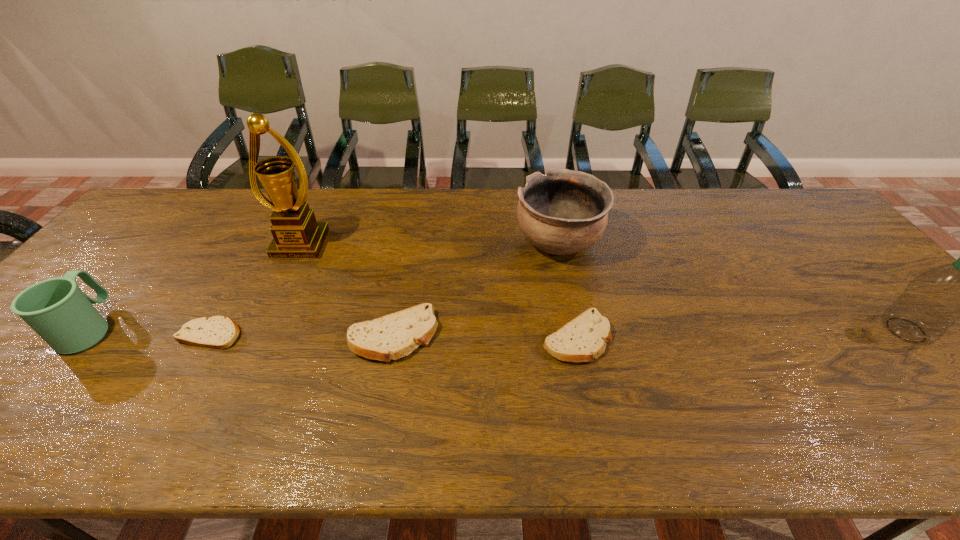
Identify the location of water bottle. (932, 302).

Find the location of a particular element. Image resolution: width=960 pixels, height=540 pixels. the rightmost object is located at coordinates (932, 302).

Where is `vacant area located 0.100m on the left of the shortest object`? vacant area located 0.100m on the left of the shortest object is located at coordinates (138, 334).

Where is `vacant position located on the right of the fourth object from right to left`? Image resolution: width=960 pixels, height=540 pixels. vacant position located on the right of the fourth object from right to left is located at coordinates (532, 336).

Where is `free space located 0.280m on the right of the rightmost pita bread`? The width and height of the screenshot is (960, 540). free space located 0.280m on the right of the rightmost pita bread is located at coordinates (727, 338).

At what (x,y) coordinates should I click in order to perform the action: click on vacant space situated on the side of the fourth shortest object with the handle. Please return your answer as a coordinate pair (x, y). This screenshot has height=540, width=960. Looking at the image, I should click on (145, 262).

The image size is (960, 540). What are the coordinates of `vacant point located 0.150m on the side of the fourth shortest object with the handle` in the screenshot? It's located at (143, 265).

Locate an element on the screen. Image resolution: width=960 pixels, height=540 pixels. vacant area located 0.310m on the side of the fourth shortest object with the handle is located at coordinates (172, 231).

Locate an element on the screen. free location located 0.060m on the front of the third tallest object is located at coordinates (567, 287).

Locate an element on the screen. vacant region located on the front-facing side of the award is located at coordinates (279, 289).